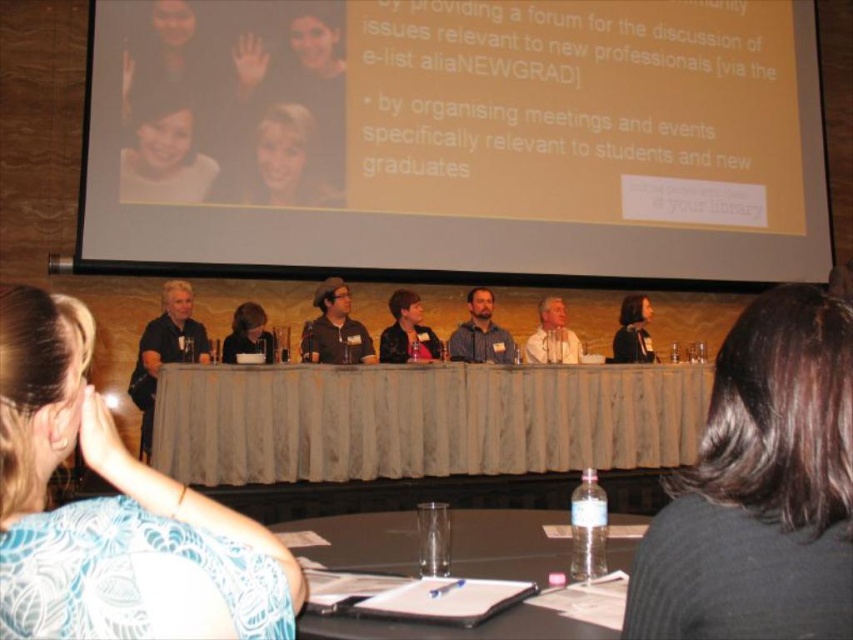
Does black shirt at left have a larger size compared to light beige shirt at center?

Yes, black shirt at left is bigger than light beige shirt at center.

Who is positioned more to the left, black shirt at left or light beige shirt at center?

black shirt at left is more to the left.

Between point (161, 333) and point (547, 355), which one is positioned behind?

Positioned behind is point (547, 355).

At what (x,y) coordinates should I click in order to perform the action: click on black shirt at left. Please return your answer as a coordinate pair (x, y). Looking at the image, I should click on (165, 352).

How distant is black shirt at left from bearded man at center?

They are 6.92 feet apart.

Between point (187, 321) and point (469, 337), which one is positioned behind?

The point (469, 337) is behind.

Image resolution: width=853 pixels, height=640 pixels. In order to click on black shirt at left in this screenshot , I will do `click(165, 352)`.

Does matte yellow projector screen at upper center have a larger size compared to black shirt at left?

No, matte yellow projector screen at upper center is not bigger than black shirt at left.

From the picture: Is matte yellow projector screen at upper center smaller than black shirt at left?

Yes, matte yellow projector screen at upper center is smaller than black shirt at left.

Is point (142, 65) behind point (149, 397)?

Yes.

Locate an element on the screen. This screenshot has height=640, width=853. matte yellow projector screen at upper center is located at coordinates (457, 138).